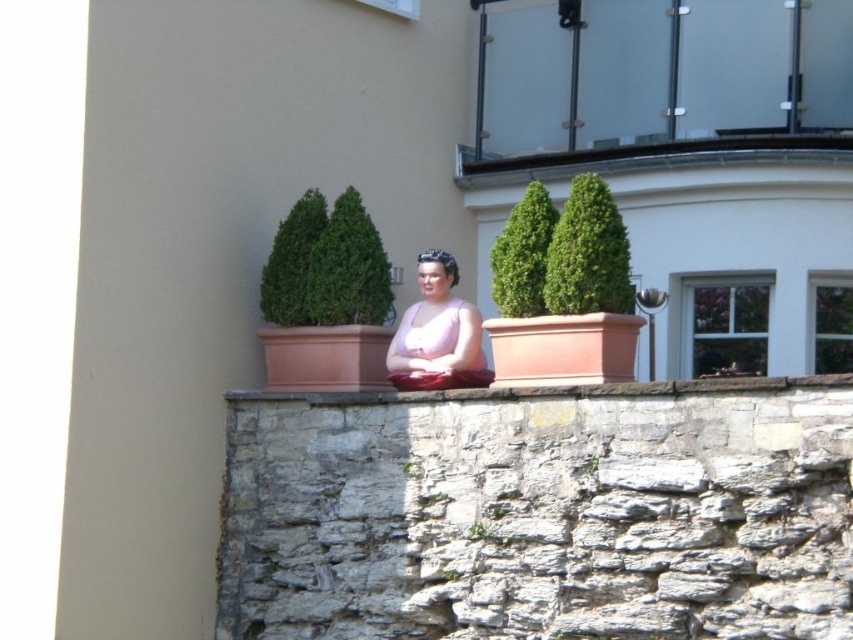
You are standing in front of the statue and want to place a small potted plant on the stone ledge at center. Can you place it directly in front of the pink matte dress at center?

The stone ledge at center is behind the pink matte dress at center, so you cannot place the potted plant directly in front of the pink matte dress at center because the ledge is located behind it.

You are a maintenance worker needing to reach the pink matte dress at center from the stone ledge at center. Given that your tool can extend up to 6 feet, will you be able to reach it?

The distance between the pink matte dress at center and the stone ledge at center is 6.31 feet, which is slightly longer than the tool can extend. Therefore, you will not be able to reach the pink matte dress at center with the current tool.